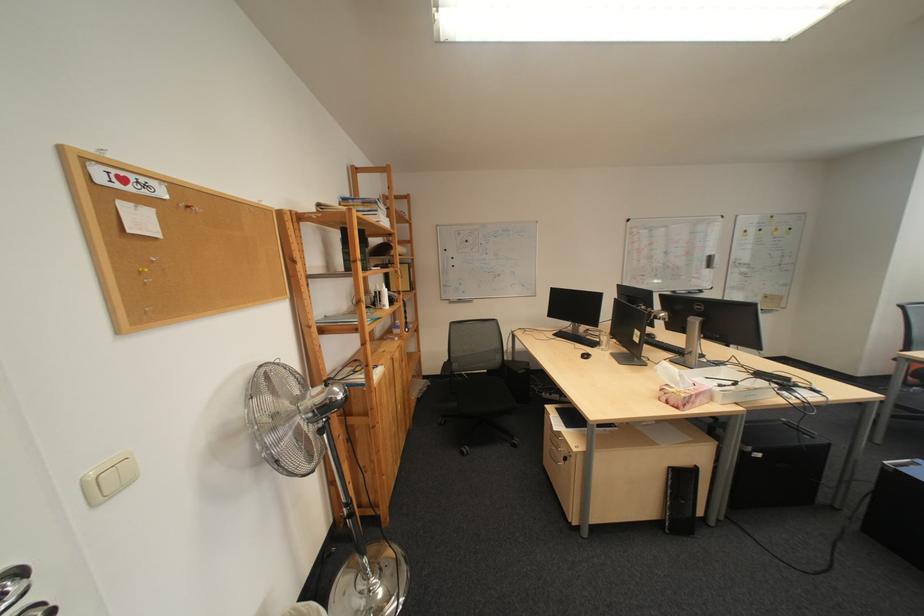
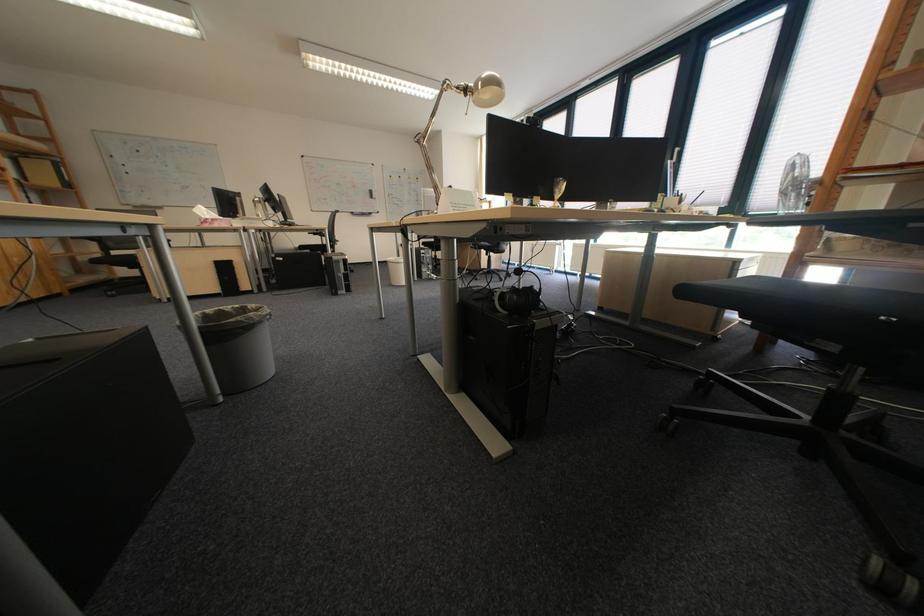
Find the pixel in the second image that matches the point at 708,405 in the first image.

(225, 225)